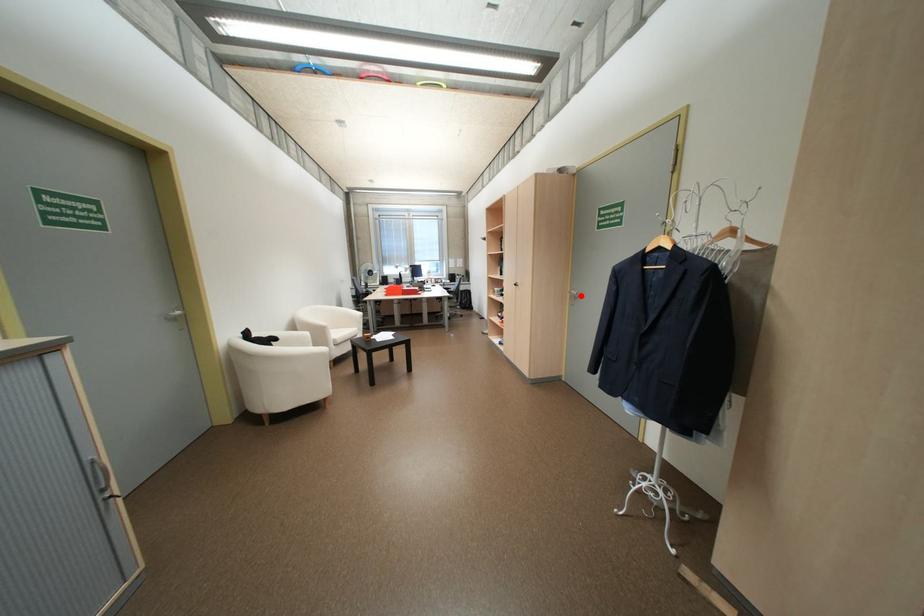
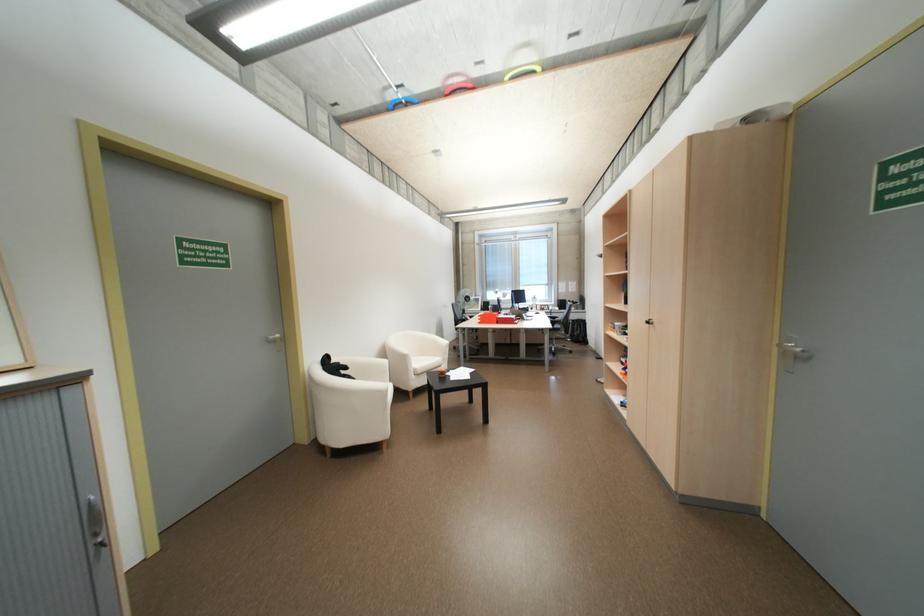
The point at the highlighted location is marked in the first image. Where is the corresponding point in the second image?

(795, 353)